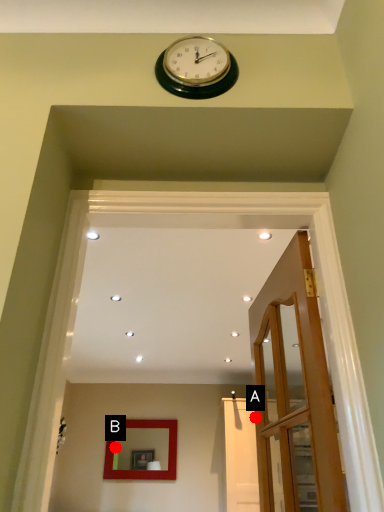
Question: Two points are circled on the image, labeled by A and B beside each circle. Which point is farther from the camera taking this photo?

Choices:
 (A) A is further
 (B) B is further

Answer: (B)